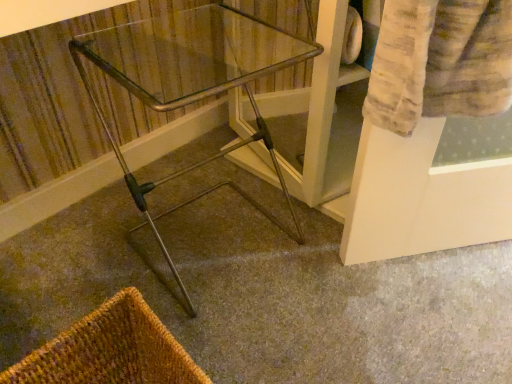
Where is `empty space that is ontop of metallic silver walker at center (from a real-world perspective)`? The height and width of the screenshot is (384, 512). empty space that is ontop of metallic silver walker at center (from a real-world perspective) is located at coordinates (269, 249).